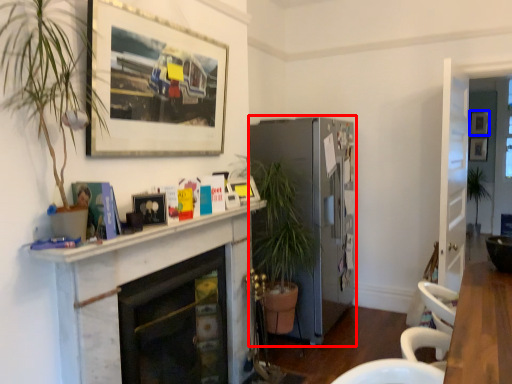
Question: Among these objects, which one is farthest to the camera, fireplace (highlighted by a red box) or picture frame (highlighted by a blue box)?

Choices:
 (A) fireplace
 (B) picture frame

Answer: (B)